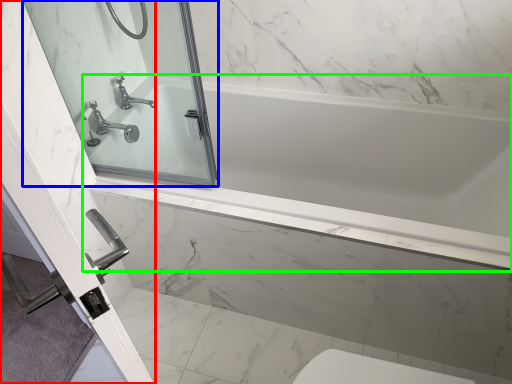
Question: Which object is the closest to the screen door (highlighted by a red box)? Choose among these: mirror (highlighted by a blue box) or bathtub (highlighted by a green box).

Choices:
 (A) mirror
 (B) bathtub

Answer: (A)